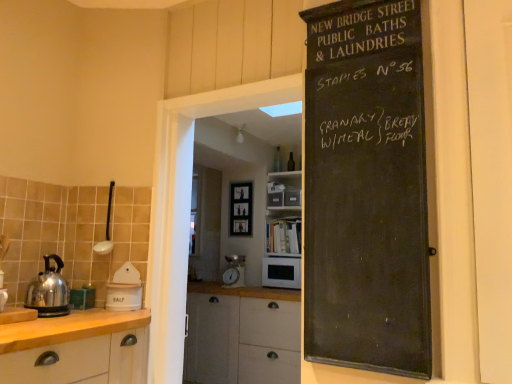
Question: Is white matte door at right bigger or smaller than white ceramic salt container at left, the 1th appliance from the bottom?

Choices:
 (A) small
 (B) big

Answer: (B)

Question: Is point (496, 263) positioned closer to the camera than point (114, 301)?

Choices:
 (A) farther
 (B) closer

Answer: (B)

Question: Based on their relative distances, which object is nearer to the white matte door at right?

Choices:
 (A) white wooden shelf at center
 (B) white glossy microwave at center
 (C) white ceramic salt container at left, marked as the second appliance in a top-to-bottom arrangement
 (D) white matte cupboard at center
 (E) polished stainless steel kettle at left

Answer: (C)

Question: Estimate the real-world distances between objects in this image. Which object is closer to the white matte door at right?

Choices:
 (A) black chalkboard at right
 (B) polished stainless steel kettle at left
 (C) metallic silver coffee machine at center
 (D) white glossy spoon at left, which ranks as the first appliance in top-to-bottom order
 (E) white wooden shelf at center

Answer: (A)